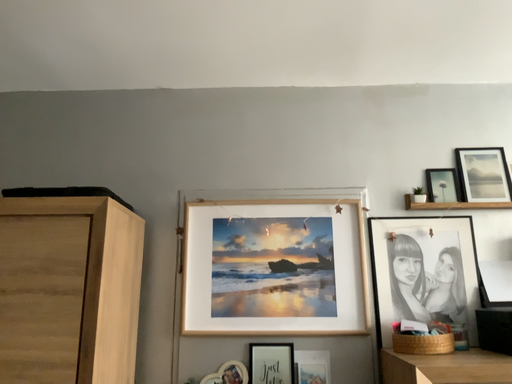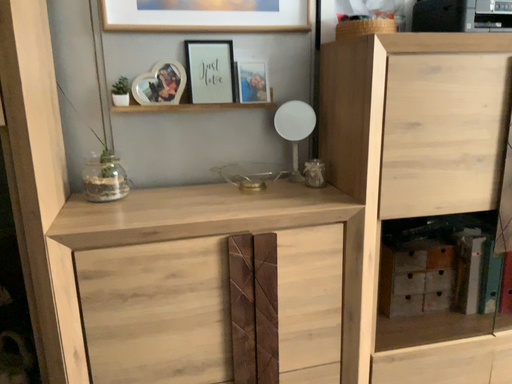
Question: How did the camera likely rotate when shooting the video?

Choices:
 (A) rotated upward
 (B) rotated downward

Answer: (B)